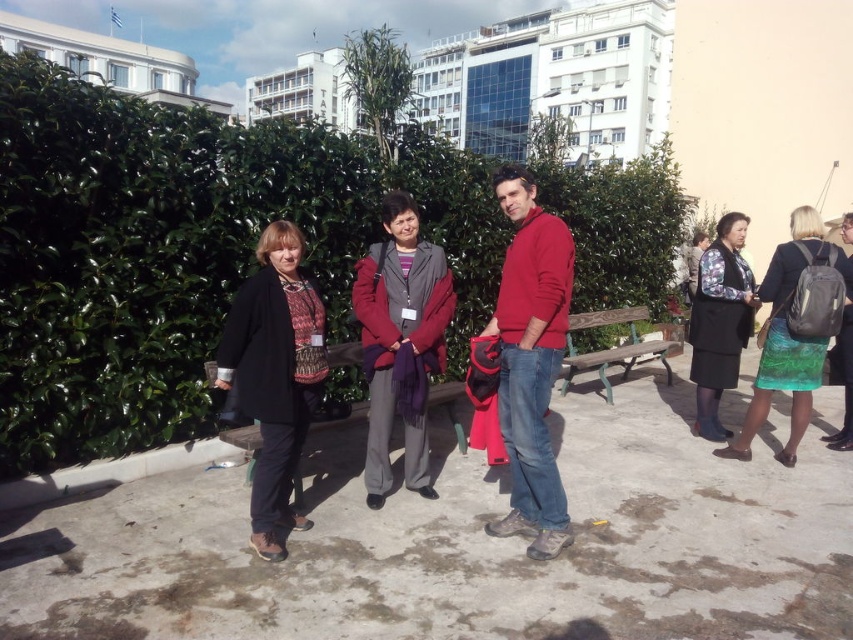
Question: Does purple scarf at center have a smaller size compared to dark gray woolen skirt at right?

Choices:
 (A) yes
 (B) no

Answer: (A)

Question: Is dark gray woolen skirt at right bigger than wooden bench at center?

Choices:
 (A) no
 (B) yes

Answer: (B)

Question: Which is farther from the wooden bench at center?

Choices:
 (A) purple scarf at center
 (B) green textured skirt at right
 (C) green leafy hedge at upper left

Answer: (B)

Question: Which of the following is the closest to the observer?

Choices:
 (A) purple scarf at center
 (B) green leafy hedge at upper left
 (C) matte black coat at left
 (D) matte red sweater at center

Answer: (D)

Question: Can you confirm if wooden park bench at center is positioned below wooden bench at center?

Choices:
 (A) no
 (B) yes

Answer: (A)

Question: Among these points, which one is nearest to the camera?

Choices:
 (A) (701, 349)
 (B) (560, 291)

Answer: (B)